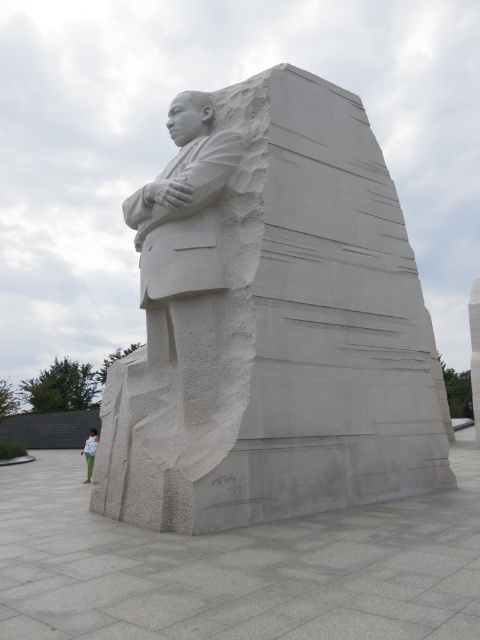
You are an art student analyzing the Martin Luther King Jr. Memorial. You observe the white stone statue at center and the green fabric pants at lower left. Which object has a greater width?

The green fabric pants at lower left has a greater width than the white stone statue at center.

You are standing in front of the Martin Luther King Jr. Memorial and want to take a photo of the white stone statue at center. If your camera can focus on objects up to 8 meters away, will you be able to capture the statue clearly?

The white stone statue at center is 7.67 meters away from camera, which is within the camera focus range of up to 8 meters. Therefore, you can capture the statue clearly.

Based on the scene description, where is the white stone statue at center located in terms of its 2D coordinates?

The white stone statue at center is located at the 2D coordinates of point (x=271, y=321).